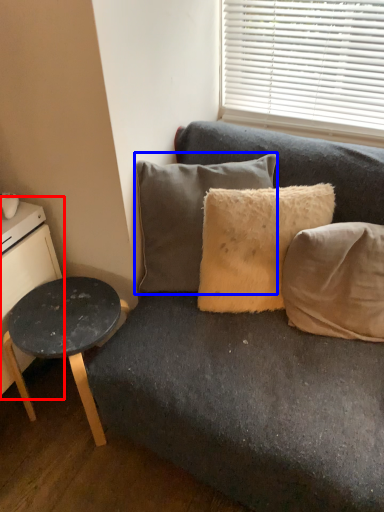
Question: Which of the following is the closest to the observer, dresser (highlighted by a red box) or pillow (highlighted by a blue box)?

Choices:
 (A) dresser
 (B) pillow

Answer: (A)